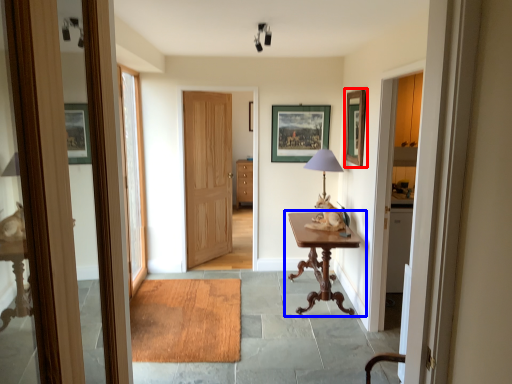
Question: Which object is closer to the camera taking this photo, picture frame (highlighted by a red box) or table (highlighted by a blue box)?

Choices:
 (A) picture frame
 (B) table

Answer: (B)